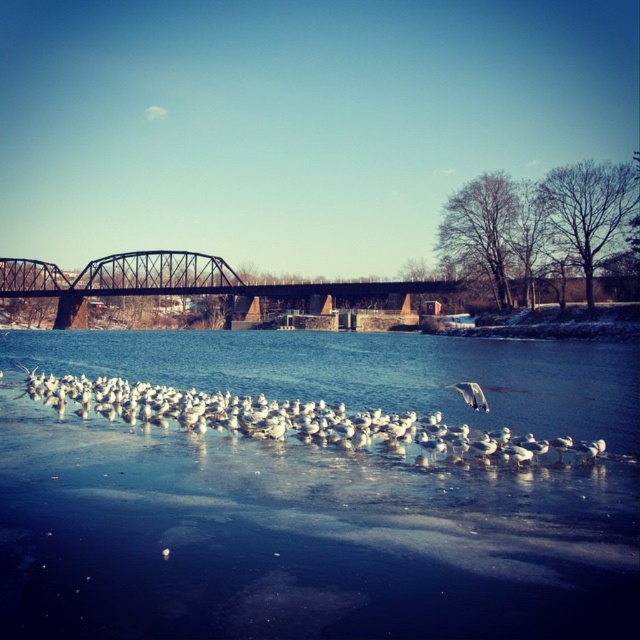
Describe the element at coordinates (300, 540) in the screenshot. I see `white ice at center` at that location.

Is white ice at center to the right of dark brown metal bridge at center from the viewer's perspective?

Correct, you'll find white ice at center to the right of dark brown metal bridge at center.

Which is in front, point (504, 492) or point (138, 280)?

Point (504, 492) is in front.

At what (x,y) coordinates should I click in order to perform the action: click on white ice at center. Please return your answer as a coordinate pair (x, y). Looking at the image, I should click on (300, 540).

Between white ice at center and white feathered bird at center, which one is positioned lower?

Positioned lower is white ice at center.

Measure the distance between white ice at center and white feathered bird at center.

The distance of white ice at center from white feathered bird at center is 40.36 feet.

Find the location of a particular element. Image resolution: width=640 pixels, height=640 pixels. white ice at center is located at coordinates (300, 540).

Which is above, white feathered birds at center or dark brown metal bridge at center?

dark brown metal bridge at center

Consider the image. Which is more to the left, white feathered birds at center or dark brown metal bridge at center?

From the viewer's perspective, dark brown metal bridge at center appears more on the left side.

This screenshot has height=640, width=640. Describe the element at coordinates (292, 420) in the screenshot. I see `white feathered birds at center` at that location.

Locate an element on the screen. white feathered birds at center is located at coordinates (292, 420).